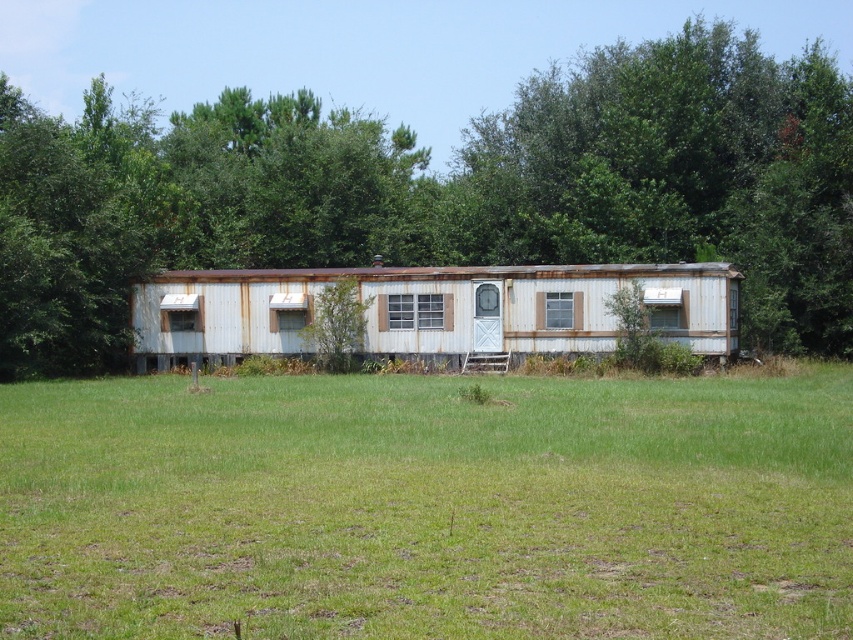
You are standing at the entrance of the mobile home and want to plant a new tree exactly where the green leafy tree at center is currently located. What are the coordinates of the spot where you should plant the new tree?

The coordinates for the green leafy tree at center are at point (x=440, y=189), so you should plant the new tree at those coordinates.

You are a painter planning to paint the green leafy tree at center and the rusty metal trailer at center. Which object requires more paint due to its size?

The green leafy tree at center requires more paint because it is larger in size than the rusty metal trailer at center.

You are standing at the point with coordinates point (440, 189). What is the nearest object to you?

The nearest object to you is the green leafy tree at center, as the point (440, 189) indicates its location.